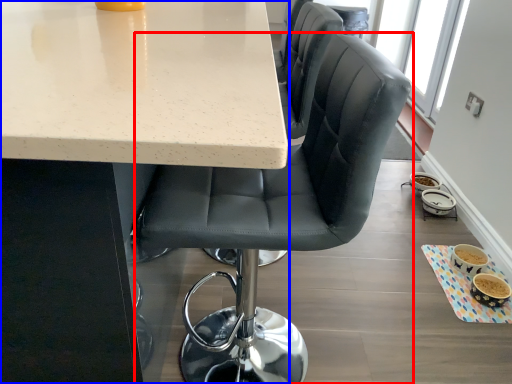
Question: Which object is closer to the camera taking this photo, chair (highlighted by a red box) or table (highlighted by a blue box)?

Choices:
 (A) chair
 (B) table

Answer: (B)